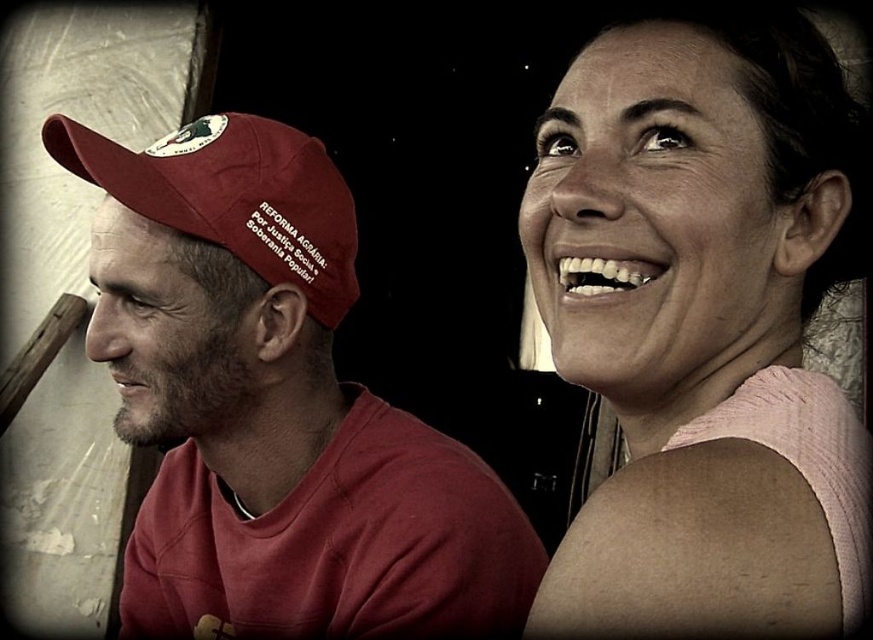
You are a photographer trying to capture a closeup of the pink fabric at upper right and the matte red cap at left in the scene. Which object should you zoom in on first to ensure it fits within the frame?

The pink fabric at upper right has a smaller size compared to the matte red cap at left, so you should zoom in on the pink fabric at upper right first to ensure it fits within the frame before adjusting for the larger matte red cap at left.

You are standing in front of the two people in the image. Which of the two points, point [825,262] or point [423,444], is closer to you?

Point [825,262] is in front of point [423,444], so it is closer to you.

Based on the photo, you are a photographer trying to capture a closeup of the pink fabric at upper right. Based on the scene description, can you estimate the coordinates where you should focus your camera lens?

The pink fabric at upper right is located at coordinates point (689, 316). You should focus your camera lens at those coordinates to capture the closeup.